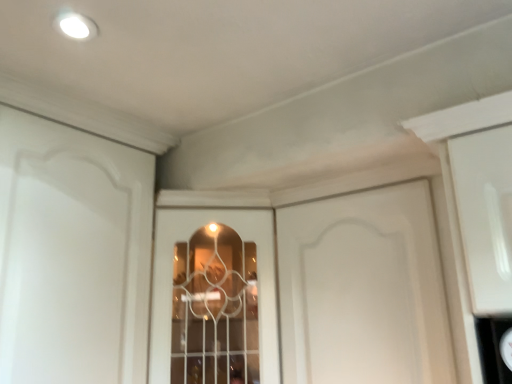
Question: Does white matte cabinet door at center have a smaller size compared to clear glass window at center?

Choices:
 (A) no
 (B) yes

Answer: (B)

Question: From the image's perspective, is white matte cabinet door at center beneath clear glass window at center?

Choices:
 (A) no
 (B) yes

Answer: (A)

Question: Is white matte cabinet door at center not near clear glass window at center?

Choices:
 (A) yes
 (B) no

Answer: (B)

Question: Considering the relative sizes of white matte cabinet door at center and clear glass window at center in the image provided, is white matte cabinet door at center thinner than clear glass window at center?

Choices:
 (A) no
 (B) yes

Answer: (B)

Question: From a real-world perspective, is white matte cabinet door at center physically below clear glass window at center?

Choices:
 (A) yes
 (B) no

Answer: (B)

Question: Does white matte cabinet door at center have a lesser height compared to clear glass window at center?

Choices:
 (A) yes
 (B) no

Answer: (A)

Question: Is white matte cabinet door at center a part of clear glass window at center?

Choices:
 (A) yes
 (B) no

Answer: (B)

Question: Is there a large distance between clear glass window at center and white matte cabinet door at center?

Choices:
 (A) yes
 (B) no

Answer: (B)

Question: From the image's perspective, is clear glass window at center beneath white matte cabinet door at center?

Choices:
 (A) yes
 (B) no

Answer: (A)

Question: Is clear glass window at center further to the viewer compared to white matte cabinet door at center?

Choices:
 (A) yes
 (B) no

Answer: (A)

Question: Can you confirm if clear glass window at center is thinner than white matte cabinet door at center?

Choices:
 (A) no
 (B) yes

Answer: (A)

Question: Considering the relative sizes of clear glass window at center and white matte cabinet door at center in the image provided, is clear glass window at center taller than white matte cabinet door at center?

Choices:
 (A) no
 (B) yes

Answer: (B)

Question: From a real-world perspective, relative to clear glass window at center, is white matte cabinet door at center vertically above or below?

Choices:
 (A) below
 (B) above

Answer: (B)